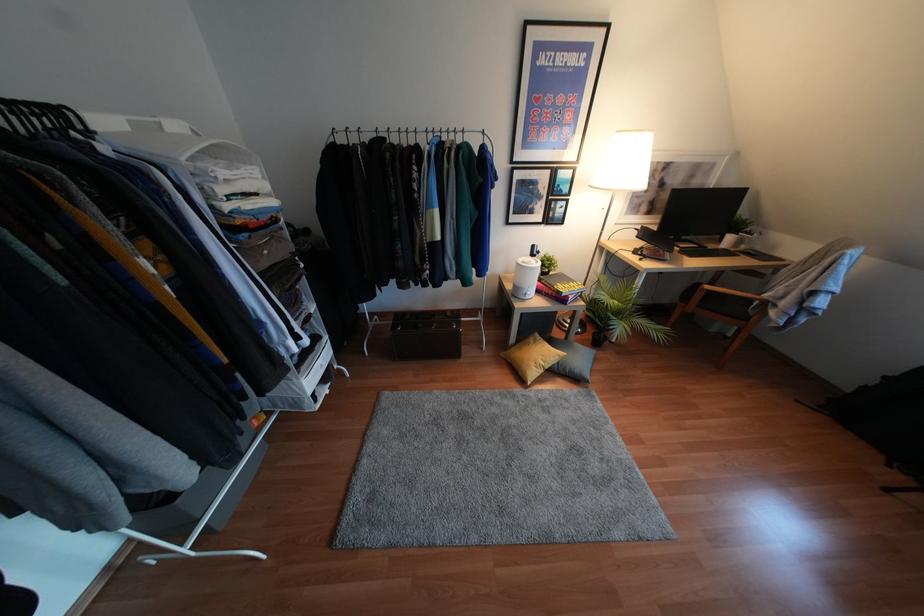
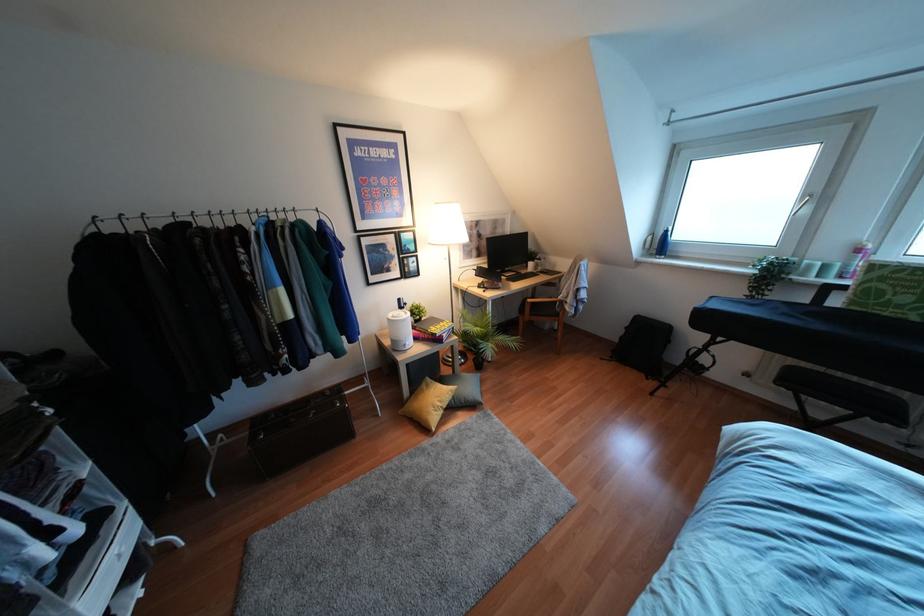
Where in the second image is the point corresponding to (541,363) from the first image?

(439, 403)